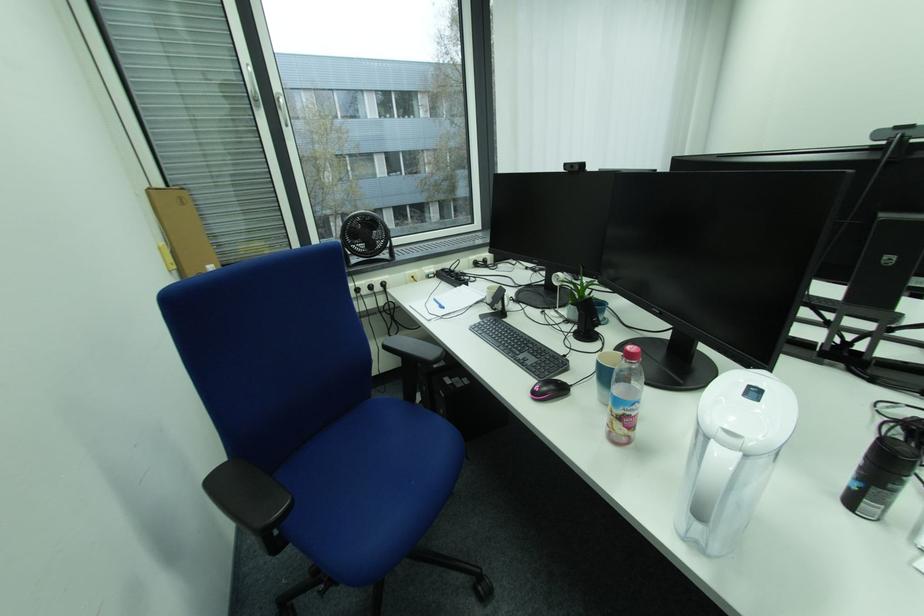
Where is `white pitcher handle`? The width and height of the screenshot is (924, 616). white pitcher handle is located at coordinates (711, 480).